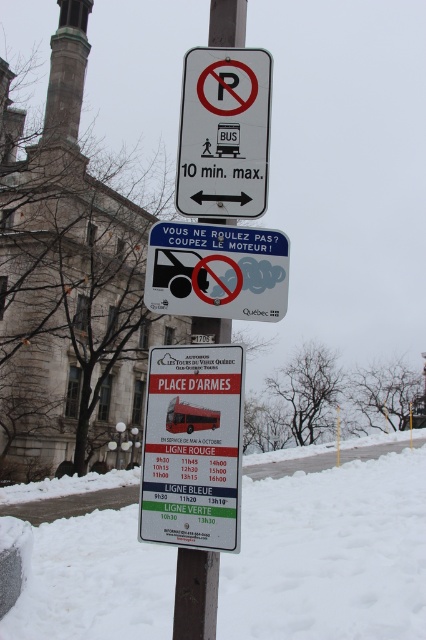
Question: Is white powdery snow at lower center above white paper bus at center?

Choices:
 (A) no
 (B) yes

Answer: (A)

Question: Based on their relative distances, which object is farther from the white paper bus at center?

Choices:
 (A) metallic pole at center
 (B) white paper sign at center

Answer: (A)

Question: Can you confirm if white paper sign at center is positioned below white plastic bus at center?

Choices:
 (A) no
 (B) yes

Answer: (B)

Question: Does white plastic bus at center appear under metallic pole at center?

Choices:
 (A) yes
 (B) no

Answer: (A)

Question: Estimate the real-world distances between objects in this image. Which object is farther from the metallic pole at center?

Choices:
 (A) white paper bus at center
 (B) white paper sign at center
 (C) white plastic bus at center
 (D) white powdery snow at lower center

Answer: (D)

Question: Considering the real-world distances, which object is farthest from the white paper bus at center?

Choices:
 (A) white powdery snow at lower center
 (B) metallic pole at center
 (C) white plastic bus at center
 (D) white paper sign at center

Answer: (A)